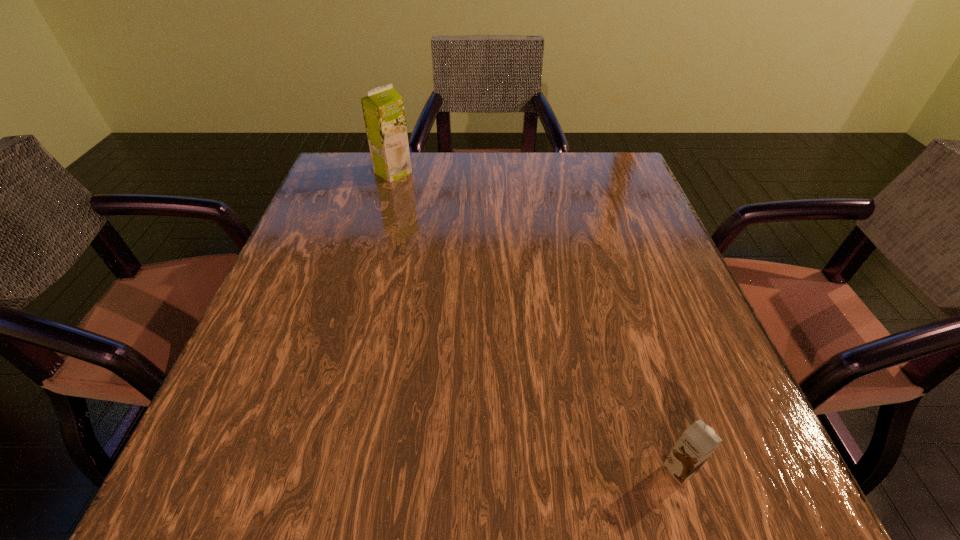
You are a GUI agent. You are given a task and a screenshot of the screen. Output one action in this format:
    pyautogui.click(x=<x>, y=<y>)
    Task: Click on the left object
    This screenshot has height=540, width=960.
    Given the screenshot: What is the action you would take?
    pyautogui.click(x=383, y=109)

Find the location of a particular element. The height and width of the screenshot is (540, 960). soya milk is located at coordinates (383, 109).

At what (x,y) coordinates should I click in order to perform the action: click on the shorter object. Please return your answer as a coordinate pair (x, y). The image size is (960, 540). Looking at the image, I should click on (697, 443).

Locate an element on the screen. The width and height of the screenshot is (960, 540). chocolate milk is located at coordinates (697, 443).

The height and width of the screenshot is (540, 960). In order to click on vacant space located 0.180m on the front of the taller object in this screenshot , I will do `click(378, 227)`.

Where is `vacant space situated 0.260m on the left of the shorter object`? vacant space situated 0.260m on the left of the shorter object is located at coordinates (468, 469).

Locate an element on the screen. The width and height of the screenshot is (960, 540). object that is positioned at the far edge is located at coordinates (383, 109).

Locate an element on the screen. object situated at the near edge is located at coordinates coord(697,443).

At what (x,y) coordinates should I click in order to perform the action: click on object at the left edge. Please return your answer as a coordinate pair (x, y). Looking at the image, I should click on (383, 109).

I want to click on object that is at the right edge, so click(697, 443).